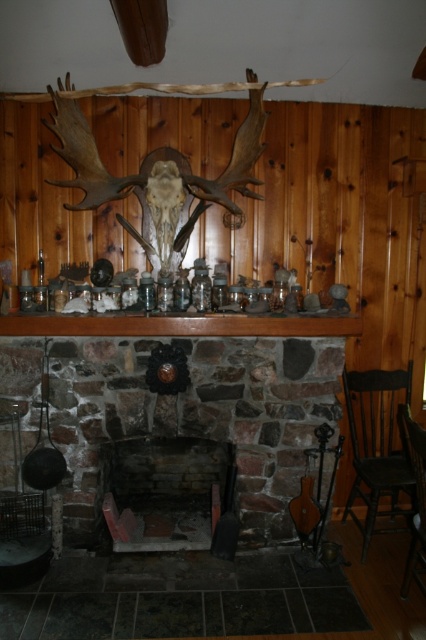
Question: Can you confirm if brick fireplace at center is positioned to the right of dark brown wooden chair at right?

Choices:
 (A) yes
 (B) no

Answer: (B)

Question: Which point is farther to the camera?

Choices:
 (A) (357, 486)
 (B) (417, 460)
 (C) (221, 472)

Answer: (C)

Question: Which of these objects is positioned closest to the black wood chair at right?

Choices:
 (A) dark brown wooden chair at right
 (B) brick fireplace at center

Answer: (A)

Question: Which point is closer to the camera?

Choices:
 (A) (376, 394)
 (B) (417, 467)

Answer: (B)

Question: Is brick fireplace at center bigger than dark brown wooden chair at right?

Choices:
 (A) no
 (B) yes

Answer: (A)

Question: Can you confirm if brick fireplace at center is positioned below black wood chair at right?

Choices:
 (A) yes
 (B) no

Answer: (A)